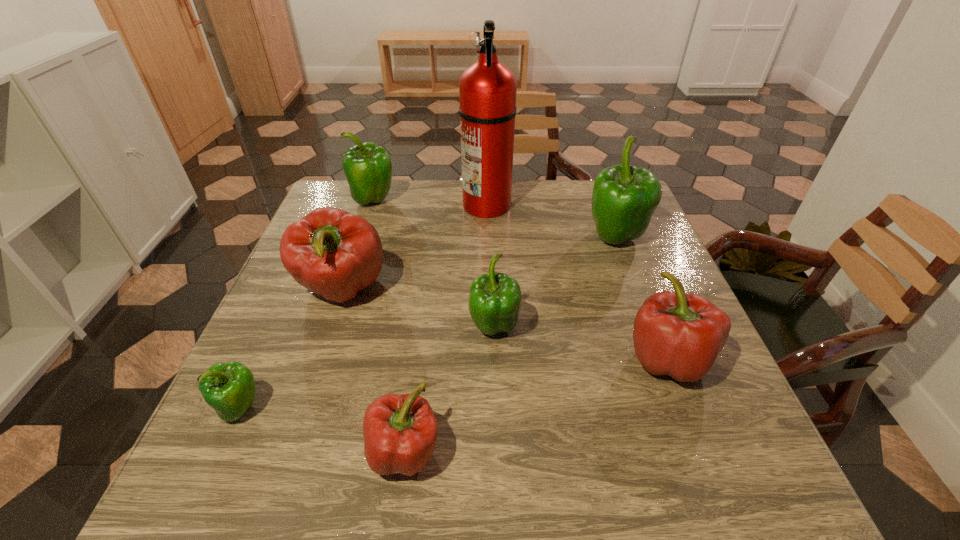
Find the location of `vacant space at the far edge of the desktop`. vacant space at the far edge of the desktop is located at coordinates (399, 181).

Find the location of a particular element. Image resolution: width=960 pixels, height=540 pixels. free space at the near edge of the desktop is located at coordinates (449, 459).

What are the coordinates of `free point at the right edge` in the screenshot? It's located at (709, 433).

This screenshot has width=960, height=540. Find the location of `free location at the far right corner`. free location at the far right corner is located at coordinates (592, 181).

The height and width of the screenshot is (540, 960). I want to click on vacant space that is in between the second green bell pepper from right to left and the biggest pink bell pepper, so click(419, 308).

This screenshot has width=960, height=540. What are the coordinates of `unoccupied area between the biggest green bell pepper and the leftmost pink bell pepper` in the screenshot? It's located at (479, 264).

You are a GUI agent. You are given a task and a screenshot of the screen. Output one action in this format:
    pyautogui.click(x=<x>, y=<y>)
    Task: Click on the free spot between the nearest green bell pepper and the red fire extinguisher
    Image resolution: width=960 pixels, height=540 pixels.
    Given the screenshot: What is the action you would take?
    pyautogui.click(x=364, y=306)

This screenshot has height=540, width=960. In order to click on unoccupied area between the leftmost green bell pepper and the fourth bell pepper from right to left in this screenshot , I will do `click(323, 429)`.

Locate an element on the screen. This screenshot has height=540, width=960. unoccupied area between the biggest pink bell pepper and the fifth bell pepper from left to right is located at coordinates (419, 308).

This screenshot has height=540, width=960. Find the location of `free space between the farthest pink bell pepper and the fifth object from right to left`. free space between the farthest pink bell pepper and the fifth object from right to left is located at coordinates (373, 370).